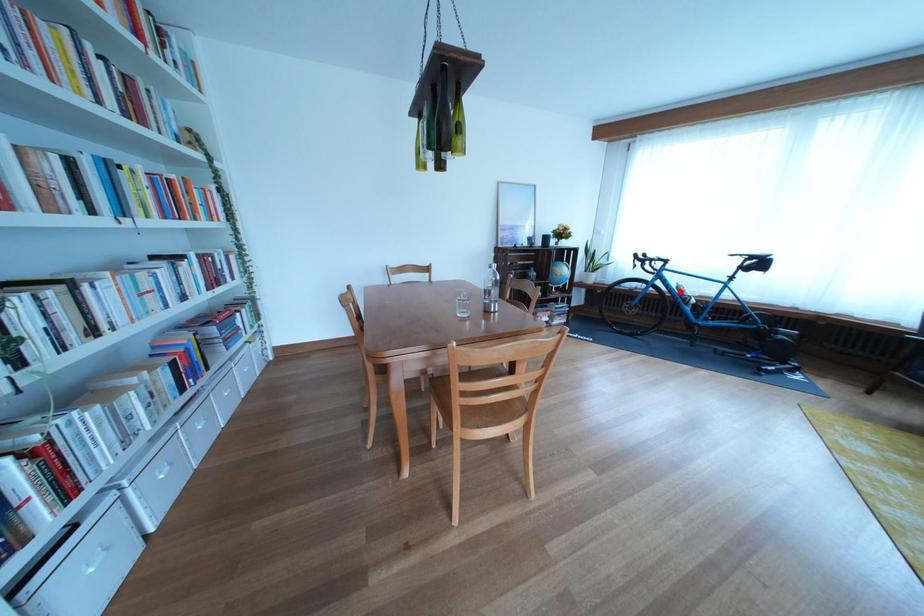
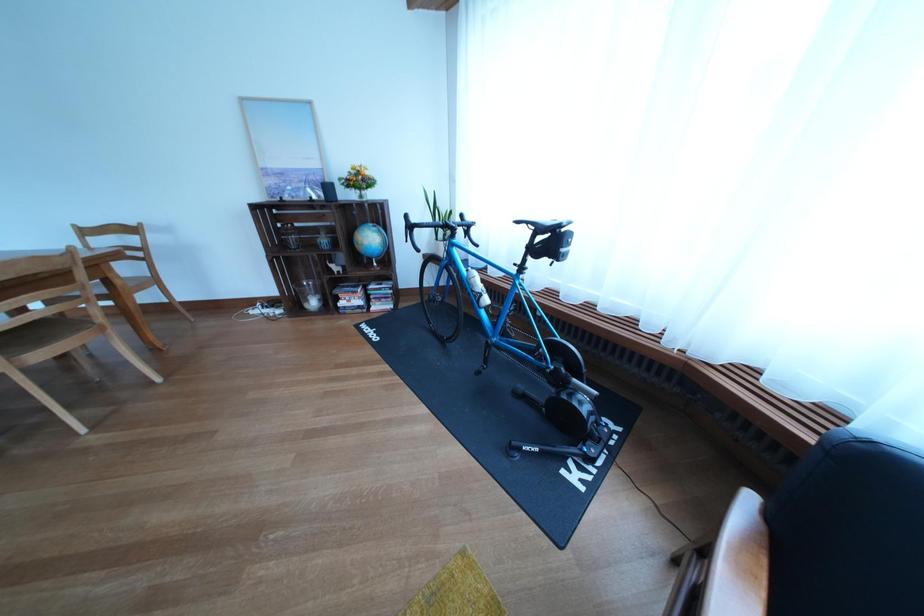
In the second image, find the point that corresponds to the highlighted location in the first image.

(470, 277)